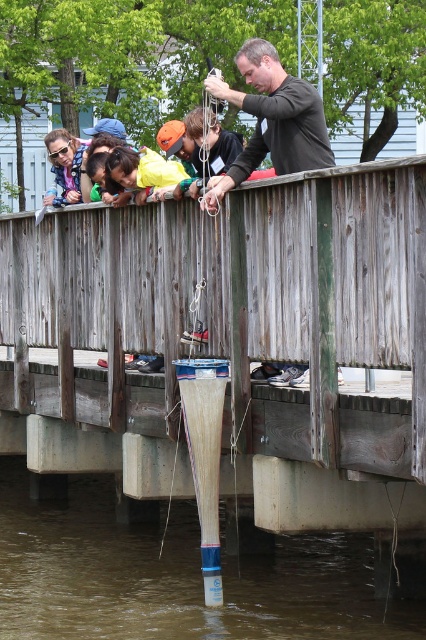
You are standing on the wooden dock and looking down. You see the transparent plastic tube at lower center and the matte black shirt at upper center. Which object is closer to your feet?

The transparent plastic tube at lower center is closer to your feet because it is located below the matte black shirt at upper center.